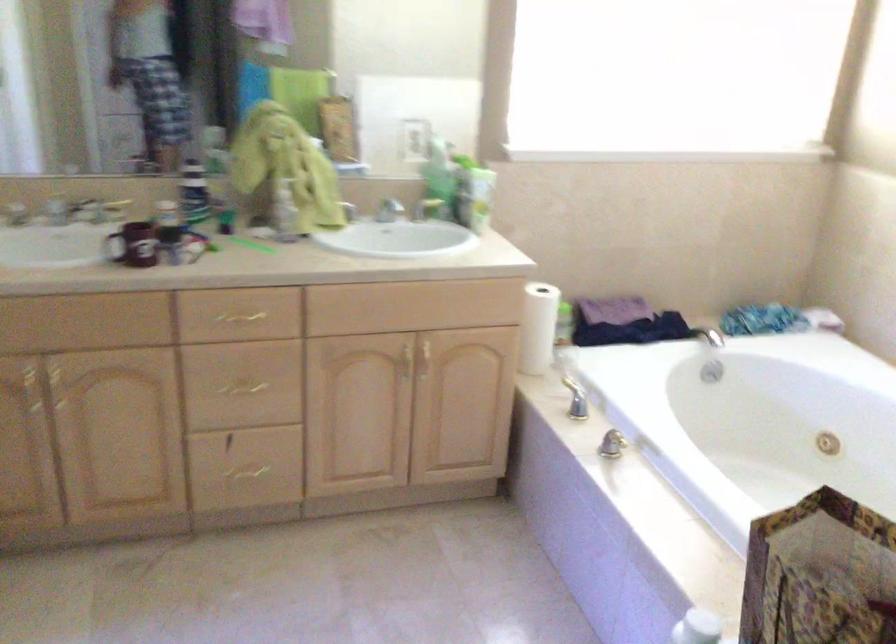
Where would you turn the bathtub knob? Please return your answer as a coordinate pair (x, y).

(828, 444)